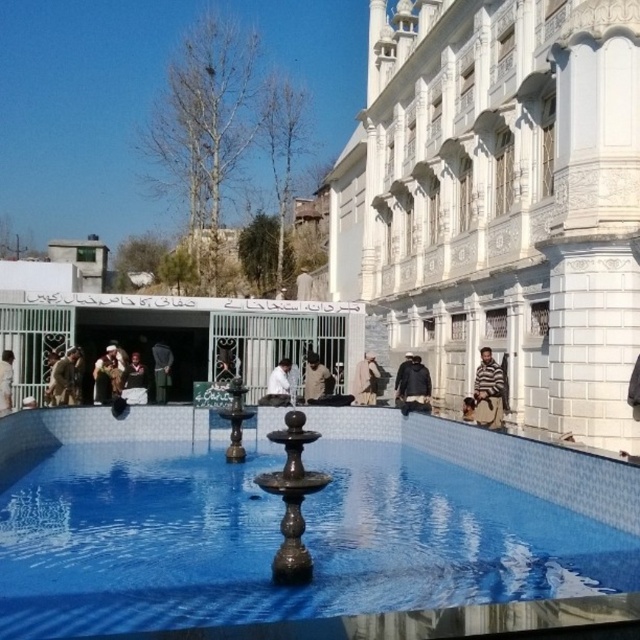
You are standing at the edge of the pool and need to place a 5.5 feet long floating dock between the brown fabric person at center and the white fabric at center. Can the dock fit between them without overlapping either object?

The distance between the brown fabric person at center and the white fabric at center is 5.70 feet. Since the dock is 5.5 feet long, it can fit between them without overlapping either object as there is a 0.2 feet gap remaining.

From the picture: You are standing at the edge of the pool and want to walk to the white stone building at right while avoiding the striped fabric person at right. Since the distance between them is 36.10 feet, can you walk around the person and reach the building without getting too close?

The white stone building at right is 36.10 feet away from the striped fabric person at right. Yes, you can walk around the person and reach the building while maintaining a safe distance of 36.10 feet between them.

You are standing at the edge of the pool and want to take a photo that includes both the white stone building at right and the striped fabric person at right. Which object should you position closer to the center of the frame to ensure both are fully visible?

You should position the white stone building at right closer to the center of the frame because it is wider than the striped fabric person at right, allowing both to fit within the frame more effectively.